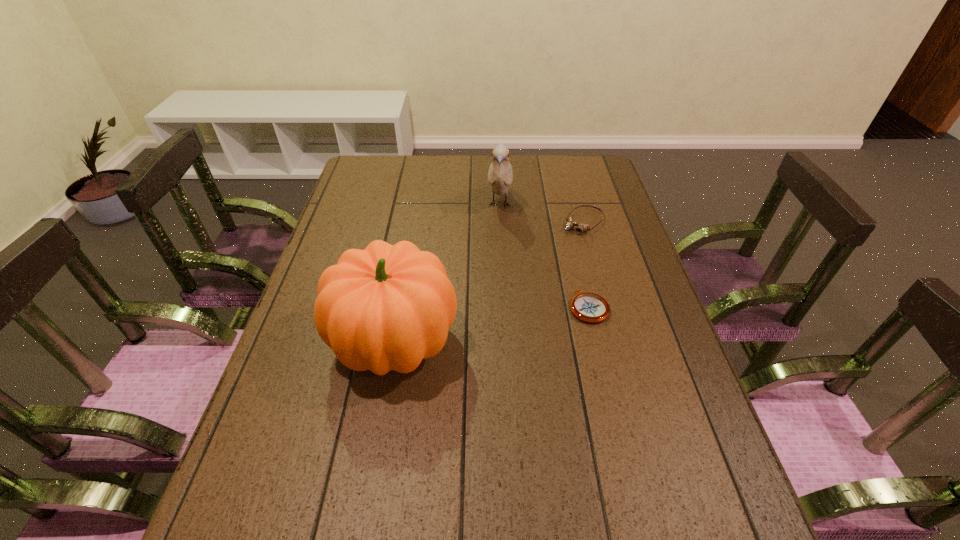
Where is `free spot on the desktop that is between the pumpkin and the compass and is positioned on the front lenses and sides of the goggles`? The height and width of the screenshot is (540, 960). free spot on the desktop that is between the pumpkin and the compass and is positioned on the front lenses and sides of the goggles is located at coordinates (481, 327).

At what (x,y) coordinates should I click in order to perform the action: click on free spot on the desktop that is between the pumpkin and the compass and is positioned at the beak of the bird. Please return your answer as a coordinate pair (x, y). This screenshot has height=540, width=960. Looking at the image, I should click on (489, 326).